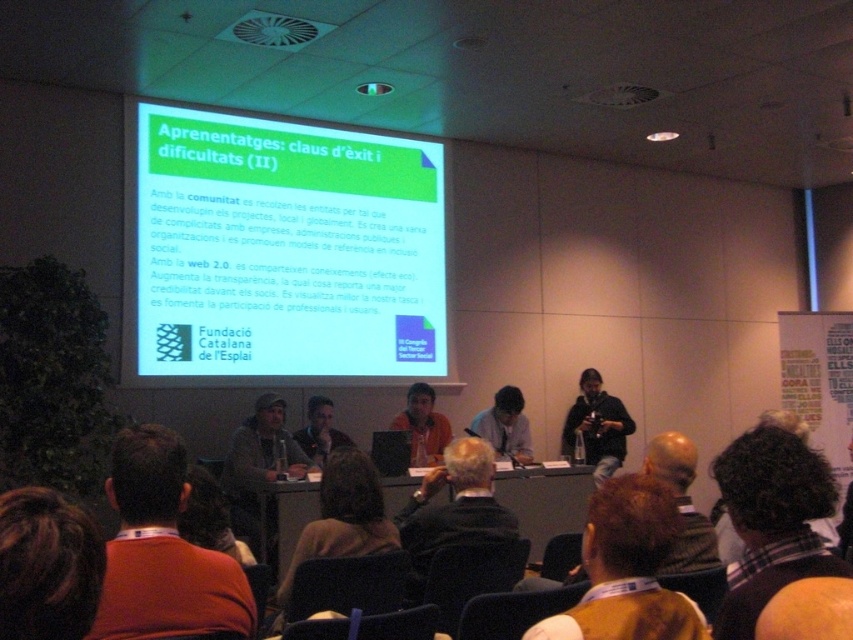
Looking at this image, is green matte projector screen at upper center shorter than brown hair at lower center?

In fact, green matte projector screen at upper center may be taller than brown hair at lower center.

Can you confirm if green matte projector screen at upper center is wider than brown hair at lower center?

Yes, green matte projector screen at upper center is wider than brown hair at lower center.

Which is in front, point (196, 276) or point (633, 634)?

Positioned in front is point (633, 634).

Find the location of `green matte projector screen at upper center`. green matte projector screen at upper center is located at coordinates (279, 252).

Can you confirm if brown hair at lower center is taller than orange shirt at center?

No.

Where is `brown hair at lower center`? The width and height of the screenshot is (853, 640). brown hair at lower center is located at coordinates (627, 570).

Which is in front, point (624, 612) or point (387, 500)?

Point (624, 612)

Based on the photo, does brown hair at lower center appear on the left side of smooth wooden table at center?

Indeed, brown hair at lower center is positioned on the left side of smooth wooden table at center.

Who is more distant from viewer, [592,497] or [576,497]?

Positioned behind is point [576,497].

This screenshot has height=640, width=853. Find the location of `brown hair at lower center`. brown hair at lower center is located at coordinates (627, 570).